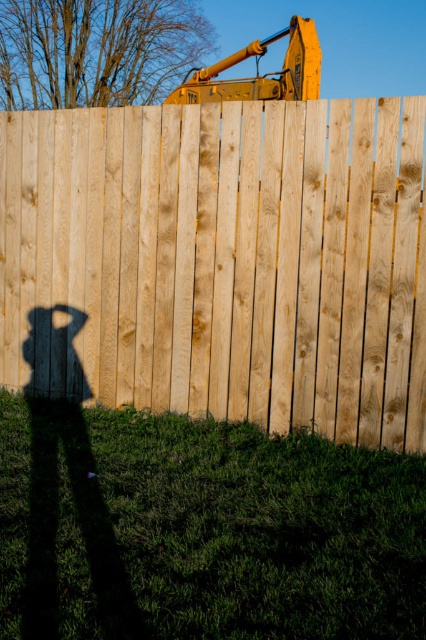
Question: Which object is farther from the camera taking this photo?

Choices:
 (A) yellow metallic excavator at upper center
 (B) natural wood fence at center

Answer: (A)

Question: Where is natural wood fence at center located in relation to yellow metallic excavator at upper center in the image?

Choices:
 (A) left
 (B) right

Answer: (A)

Question: Does natural wood fence at center have a larger size compared to yellow metallic excavator at upper center?

Choices:
 (A) no
 (B) yes

Answer: (A)

Question: Which of the following is the farthest from the observer?

Choices:
 (A) natural wood fence at center
 (B) yellow metallic excavator at upper center

Answer: (B)

Question: Can you confirm if natural wood fence at center is thinner than yellow metallic excavator at upper center?

Choices:
 (A) yes
 (B) no

Answer: (A)